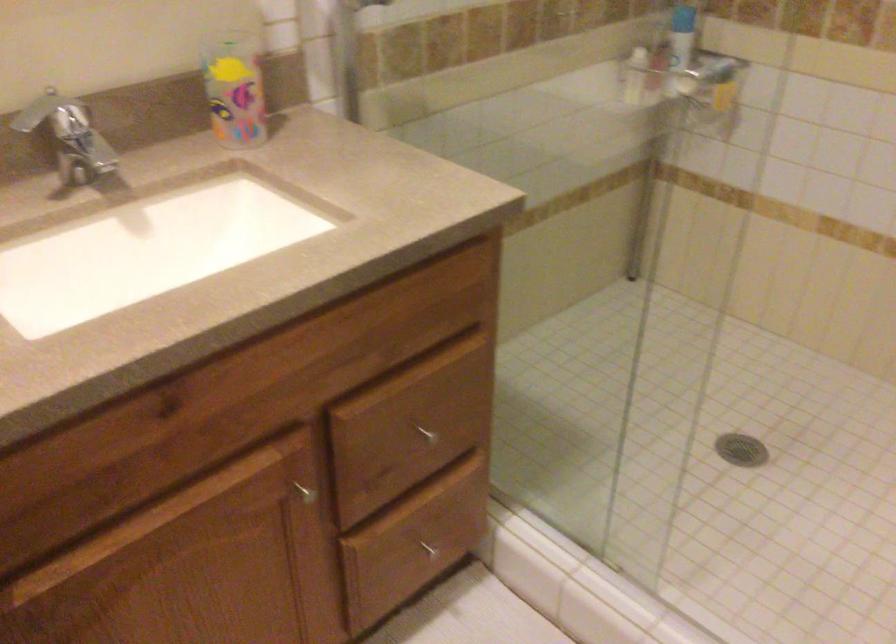
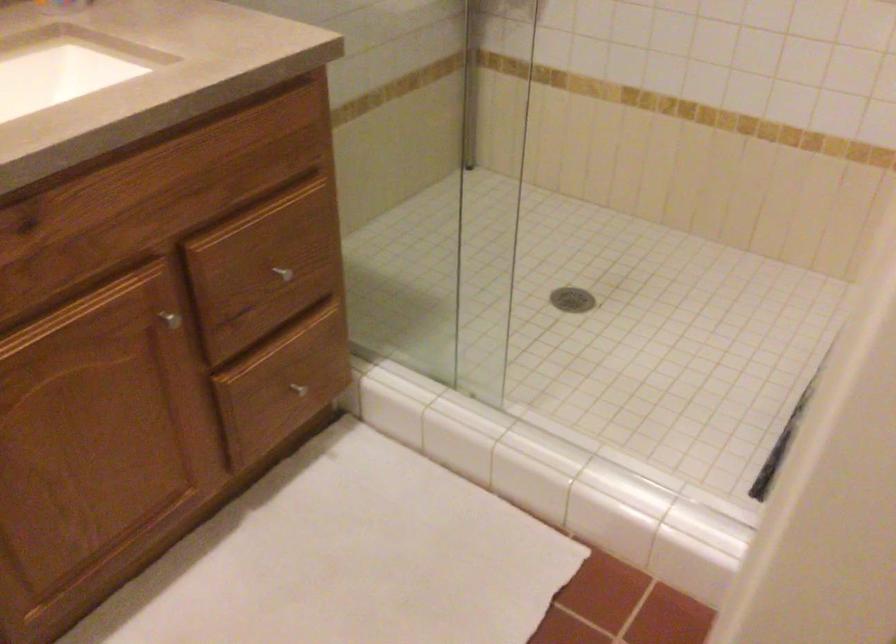
Question: Which direction would the cameraman need to move to produce the second image? Reply with the corresponding letter.

Choices:
 (A) Left
 (B) Right
 (C) Forward
 (D) Backward

Answer: (D)